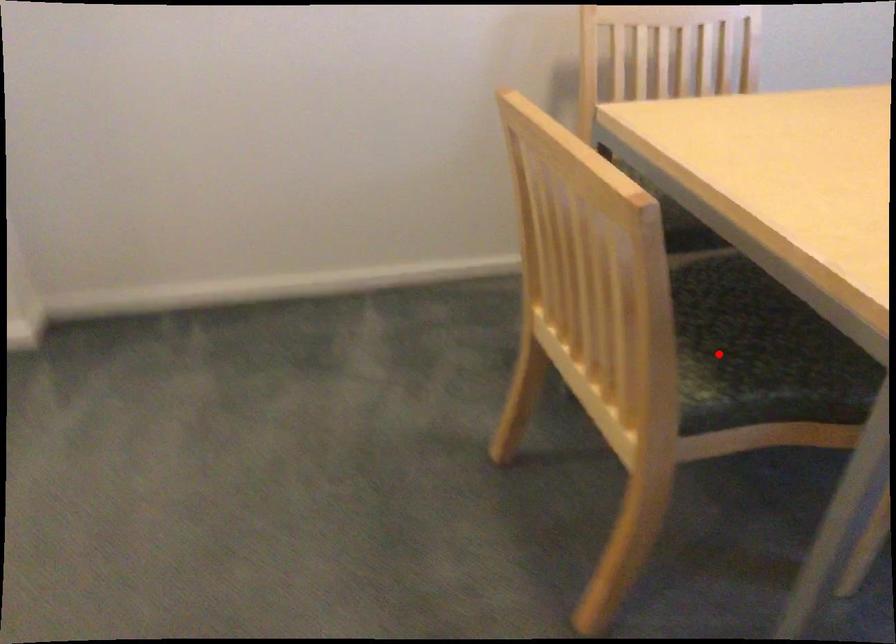
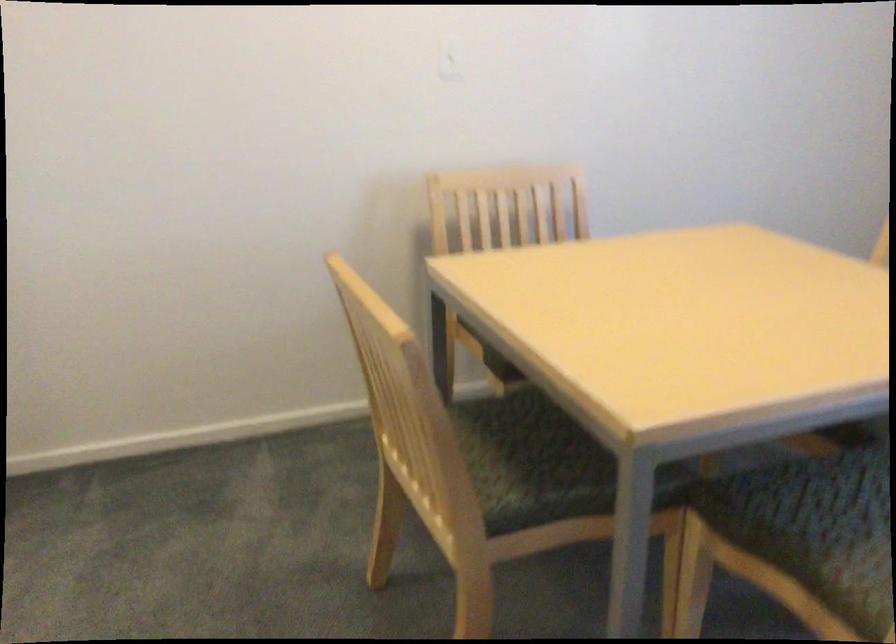
Question: I am providing you with two images of the same scene from different viewpoints. Image1 has a red point marked. In image2, the corresponding 3D location appears at what relative position? Reply with the corresponding letter.

Choices:
 (A) Closer
 (B) Farther

Answer: (B)